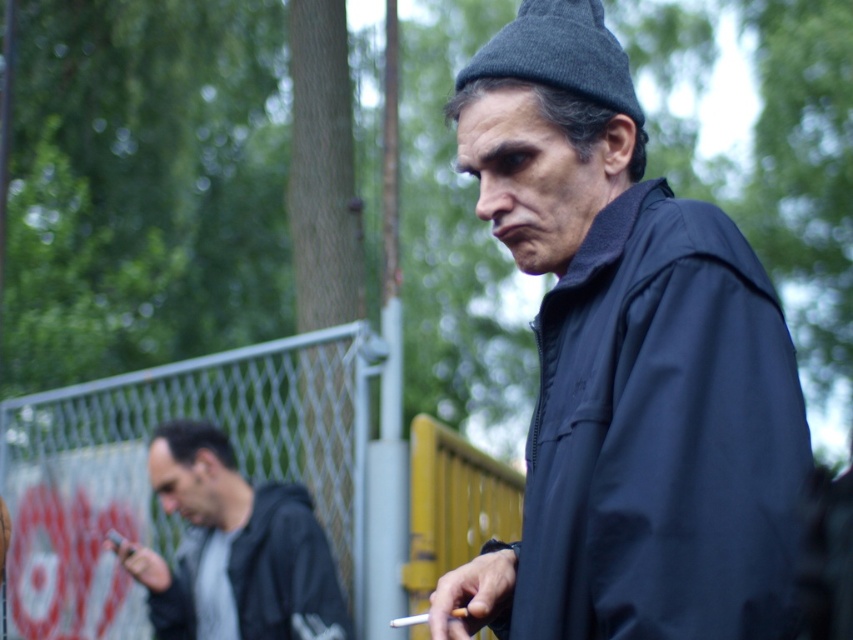
You are standing at the point closest to you in the image. There are two points marked in the scene, point (245, 493) and point (462, 611). If you want to move towards the point that is farther away from you, which coordinate should you head towards?

Point (245, 493) is behind point (462, 611), so to move towards the farther point, you should head towards point (245, 493).

You are a photographer trying to capture the scene with a camera that has a limited focus range. You want to ensure both the dark gray hoodie at left and the white matte cigarette at center are in focus. Given their sizes, which object should you adjust your focus on to maximize the chances of both being sharp?

The dark gray hoodie at left is bigger than the white matte cigarette at center, so focusing on the dark gray hoodie at left would likely keep both objects in focus since it is larger and occupies more space in the frame.